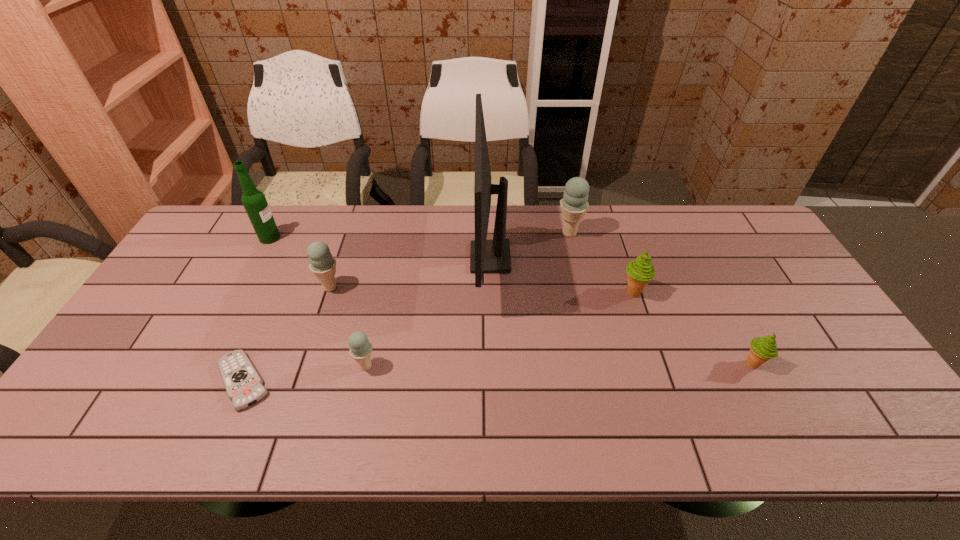
Identify the location of the smallest blue ice cream. [360, 349].

Locate an element on the screen. This screenshot has width=960, height=540. the fourth icecream from right to left is located at coordinates (360, 349).

I want to click on the rightmost object, so click(x=762, y=349).

I want to click on the smaller green icecream, so click(762, 349).

At what (x,y) coordinates should I click in order to perform the action: click on the seventh object from right to left. Please return your answer as a coordinate pair (x, y). Looking at the image, I should click on tap(243, 384).

I want to click on the shortest object, so click(243, 384).

Identify the location of vacant space located on the front-facing side of the computer monitor. The image size is (960, 540). (369, 258).

The width and height of the screenshot is (960, 540). I want to click on free space located 0.200m on the front-facing side of the computer monitor, so click(x=407, y=258).

What are the coordinates of `vacant space located 0.290m on the front-facing side of the computer monitor` in the screenshot? It's located at (378, 258).

What are the coordinates of `vacant space situated on the label of the beer bottle` in the screenshot? It's located at (316, 238).